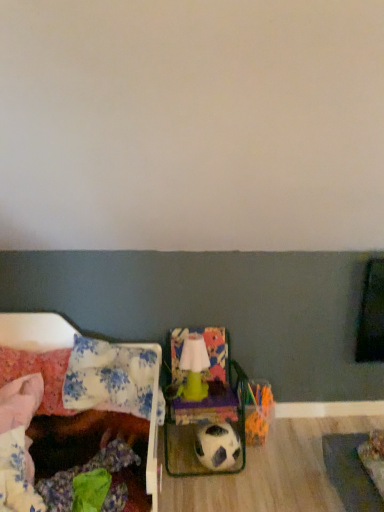
You are a GUI agent. You are given a task and a screenshot of the screen. Output one action in this format:
    pyautogui.click(x=<x>, y=<y>)
    Task: Click on the empty space that is ontop of black and white textured football at center (from a real-world perspective)
    This screenshot has width=384, height=512.
    Given the screenshot: What is the action you would take?
    pyautogui.click(x=221, y=431)